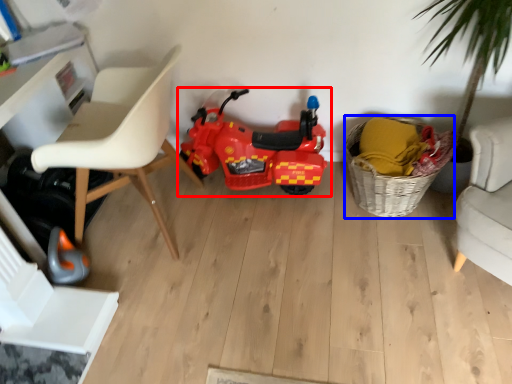
Question: Which point is closer to the camera, land vehicle (highlighted by a red box) or basket (highlighted by a blue box)?

Choices:
 (A) land vehicle
 (B) basket

Answer: (B)